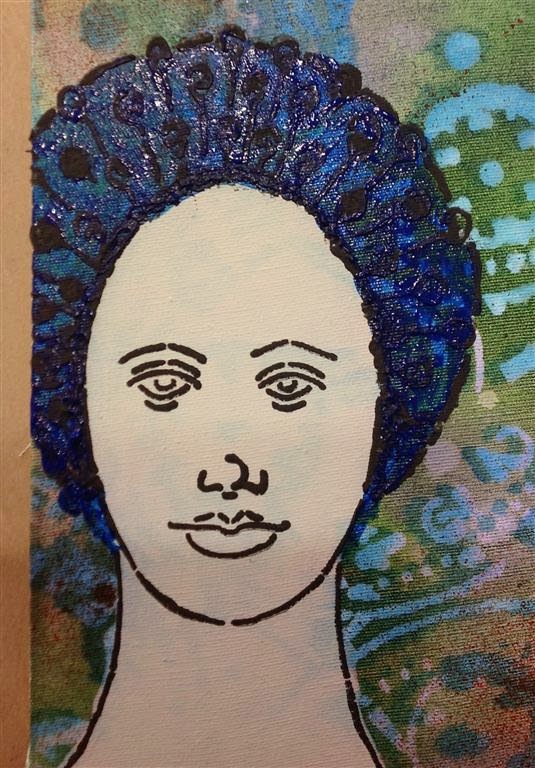
The image size is (535, 768). Find the location of `clock face`. clock face is located at coordinates (457, 435).